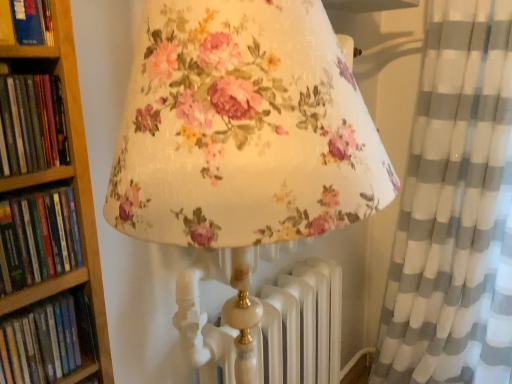
Question: Considering the relative sizes of green matte book at left, arranged as the second book when viewed from the top, and hardcover book at left, arranged as the 4th book when viewed from the top, in the image provided, is green matte book at left, arranged as the second book when viewed from the top, taller than hardcover book at left, arranged as the 4th book when viewed from the top,?

Choices:
 (A) yes
 (B) no

Answer: (A)

Question: From a real-world perspective, is green matte book at left, arranged as the second book when viewed from the top, positioned under hardcover book at left, arranged as the 4th book when viewed from the top, based on gravity?

Choices:
 (A) yes
 (B) no

Answer: (B)

Question: Is green matte book at left, arranged as the second book when viewed from the top, located outside hardcover book at left, the 1th book in the bottom-to-top sequence?

Choices:
 (A) yes
 (B) no

Answer: (A)

Question: Considering the relative sizes of green matte book at left, which ranks as the 3th book in bottom-to-top order, and hardcover book at left, the 1th book in the bottom-to-top sequence, in the image provided, is green matte book at left, which ranks as the 3th book in bottom-to-top order, wider than hardcover book at left, the 1th book in the bottom-to-top sequence,?

Choices:
 (A) no
 (B) yes

Answer: (B)

Question: Would you say hardcover book at left, arranged as the 4th book when viewed from the top, is part of green matte book at left, arranged as the second book when viewed from the top,'s contents?

Choices:
 (A) no
 (B) yes

Answer: (A)

Question: Is green matte book at left, arranged as the second book when viewed from the top, to the left of hardcover book at left, the 1th book in the bottom-to-top sequence, from the viewer's perspective?

Choices:
 (A) yes
 (B) no

Answer: (B)

Question: Is hardcover book at left, arranged as the 4th book when viewed from the top, surrounding white/grey striped curtain at right?

Choices:
 (A) yes
 (B) no

Answer: (B)

Question: Is hardcover book at left, the 1th book in the bottom-to-top sequence, aimed at white/grey striped curtain at right?

Choices:
 (A) yes
 (B) no

Answer: (B)

Question: Is hardcover book at left, the 1th book in the bottom-to-top sequence, oriented away from white/grey striped curtain at right?

Choices:
 (A) yes
 (B) no

Answer: (B)

Question: From the image's perspective, is hardcover book at left, the 1th book in the bottom-to-top sequence, located beneath white/grey striped curtain at right?

Choices:
 (A) no
 (B) yes

Answer: (B)

Question: Can you confirm if hardcover book at left, arranged as the 4th book when viewed from the top, is shorter than white/grey striped curtain at right?

Choices:
 (A) yes
 (B) no

Answer: (A)

Question: Can you confirm if hardcover book at left, arranged as the 4th book when viewed from the top, is wider than white/grey striped curtain at right?

Choices:
 (A) yes
 (B) no

Answer: (B)

Question: From a real-world perspective, is hardcover book at upper left, which appears as the 4th book when ordered from the bottom, beneath green matte book at left, arranged as the second book when viewed from the top?

Choices:
 (A) yes
 (B) no

Answer: (B)